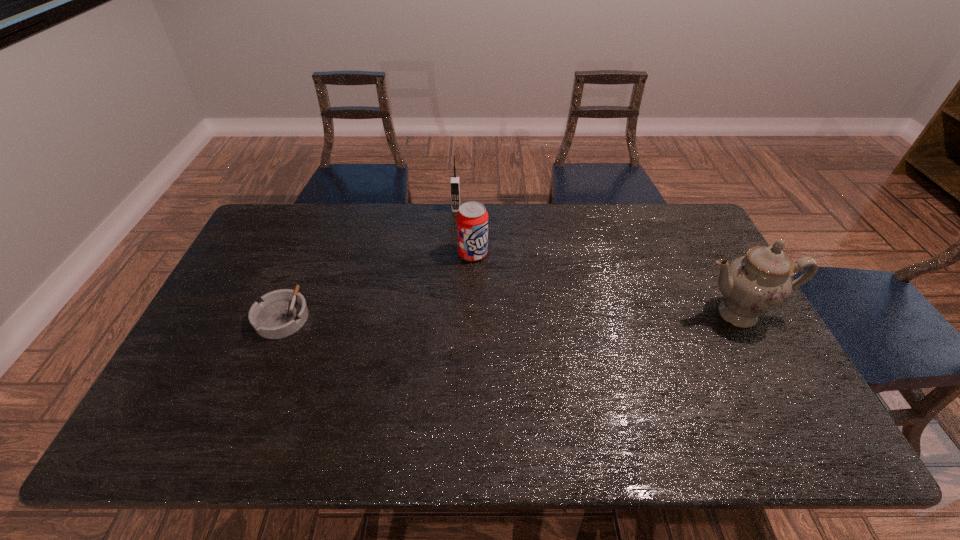
I want to click on free space located on the surface of the third tallest object, so click(560, 350).

The height and width of the screenshot is (540, 960). Find the location of `free space located on the surface of the third tallest object`. free space located on the surface of the third tallest object is located at coordinates (550, 340).

Identify the location of vacant space located on the surface of the third tallest object. (524, 311).

Identify the location of vacant space located 0.370m on the front-facing side of the cellular telephone. The height and width of the screenshot is (540, 960). (449, 287).

Locate an element on the screen. The width and height of the screenshot is (960, 540). free space located 0.290m on the front-facing side of the cellular telephone is located at coordinates (451, 268).

Locate an element on the screen. This screenshot has height=540, width=960. blank space located on the front-facing side of the cellular telephone is located at coordinates (455, 221).

Image resolution: width=960 pixels, height=540 pixels. Identify the location of soda can situated at the far edge. (472, 218).

Where is `cellular telephone situated at the far edge`? cellular telephone situated at the far edge is located at coordinates (455, 181).

This screenshot has height=540, width=960. In order to click on object present at the left edge in this screenshot , I will do `click(281, 313)`.

In order to click on object present at the right edge in this screenshot , I will do `click(754, 284)`.